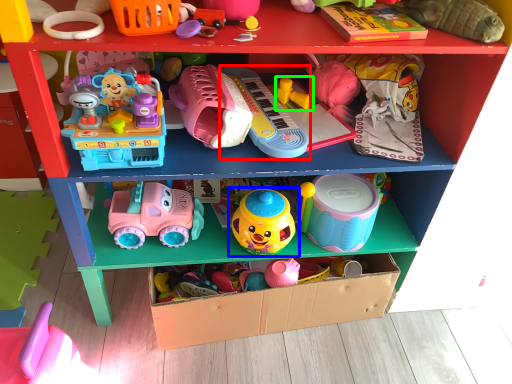
Question: Based on their relative distances, which object is nearer to toy (highlighted by a red box)? Choose from toy (highlighted by a blue box) and toy (highlighted by a green box).

Choices:
 (A) toy
 (B) toy

Answer: (B)